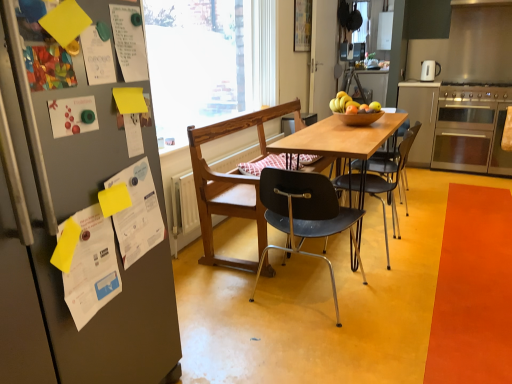
Question: Is black plastic chair at center, the first chair when ordered from front to back, shorter than orange matte mat at lower right?

Choices:
 (A) yes
 (B) no

Answer: (B)

Question: Is black plastic chair at center, the first chair when ordered from front to back, bigger than orange matte mat at lower right?

Choices:
 (A) no
 (B) yes

Answer: (B)

Question: Is black plastic chair at center, which appears as the 3th chair when viewed from the back, positioned with its back to orange matte mat at lower right?

Choices:
 (A) yes
 (B) no

Answer: (B)

Question: From a real-world perspective, is black plastic chair at center, which appears as the 3th chair when viewed from the back, on orange matte mat at lower right?

Choices:
 (A) yes
 (B) no

Answer: (A)

Question: Does black plastic chair at center, the first chair when ordered from front to back, have a lesser width compared to orange matte mat at lower right?

Choices:
 (A) yes
 (B) no

Answer: (A)

Question: Does black plastic chair at center, which appears as the 3th chair when viewed from the back, lie behind orange matte mat at lower right?

Choices:
 (A) yes
 (B) no

Answer: (A)

Question: Is orange matte mat at lower right smaller than wooden chair at center, placed as the second chair when sorted from back to front?

Choices:
 (A) no
 (B) yes

Answer: (B)

Question: Does orange matte mat at lower right have a larger size compared to wooden chair at center, placed as the second chair when sorted from back to front?

Choices:
 (A) no
 (B) yes

Answer: (A)

Question: From a real-world perspective, is orange matte mat at lower right on wooden chair at center, the second chair when ordered from front to back?

Choices:
 (A) yes
 (B) no

Answer: (B)

Question: Is the position of orange matte mat at lower right more distant than that of wooden chair at center, placed as the second chair when sorted from back to front?

Choices:
 (A) yes
 (B) no

Answer: (B)

Question: Considering the relative positions of orange matte mat at lower right and wooden chair at center, placed as the second chair when sorted from back to front, in the image provided, is orange matte mat at lower right to the right of wooden chair at center, placed as the second chair when sorted from back to front, from the viewer's perspective?

Choices:
 (A) no
 (B) yes

Answer: (B)

Question: Is orange matte mat at lower right wider than wooden chair at center, the second chair when ordered from front to back?

Choices:
 (A) no
 (B) yes

Answer: (B)

Question: Can you confirm if black plastic chair at center, the first chair when ordered from front to back, is bigger than multicolored paper at left, arranged as the first poster when viewed from the left?

Choices:
 (A) no
 (B) yes

Answer: (B)